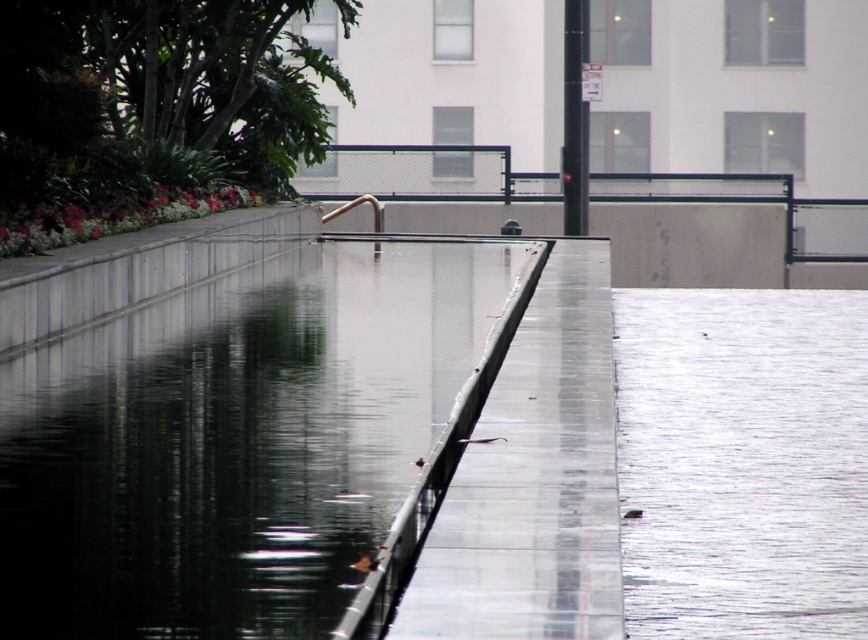
Does point (293, 561) come behind point (630, 560)?

No, it is not.

Describe the element at coordinates (234, 442) in the screenshot. I see `transparent glass water at center` at that location.

This screenshot has height=640, width=868. Find the location of `transparent glass water at center`. transparent glass water at center is located at coordinates 234,442.